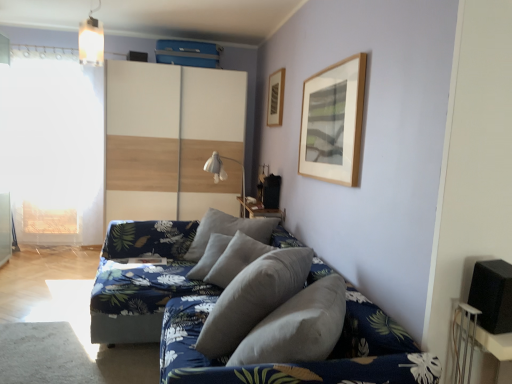
Question: From a real-world perspective, is white fabric lampshade at center physically above white wood dresser at center?

Choices:
 (A) yes
 (B) no

Answer: (B)

Question: From the image's perspective, does white fabric lampshade at center appear higher than white wood dresser at center?

Choices:
 (A) yes
 (B) no

Answer: (B)

Question: Does white fabric lampshade at center appear on the left side of white wood dresser at center?

Choices:
 (A) yes
 (B) no

Answer: (B)

Question: Are white fabric lampshade at center and white wood dresser at center beside each other?

Choices:
 (A) yes
 (B) no

Answer: (B)

Question: Does white fabric lampshade at center turn towards white wood dresser at center?

Choices:
 (A) yes
 (B) no

Answer: (B)

Question: Is black matte speaker at right to the left or to the right of metallic pendant light at upper center in the image?

Choices:
 (A) right
 (B) left

Answer: (A)

Question: From a real-world perspective, is black matte speaker at right physically located above or below metallic pendant light at upper center?

Choices:
 (A) above
 (B) below

Answer: (B)

Question: In terms of height, does black matte speaker at right look taller or shorter compared to metallic pendant light at upper center?

Choices:
 (A) short
 (B) tall

Answer: (A)

Question: Do you think black matte speaker at right is within metallic pendant light at upper center, or outside of it?

Choices:
 (A) inside
 (B) outside

Answer: (B)

Question: Considering their positions, is wooden table at center, which is the 1th table from left to right, located in front of or behind white wood dresser at center?

Choices:
 (A) behind
 (B) front

Answer: (B)

Question: From a real-world perspective, is wooden table at center, the second table from the bottom, positioned above or below white wood dresser at center?

Choices:
 (A) below
 (B) above

Answer: (A)

Question: Looking at the image, does wooden table at center, the second table from the bottom, seem bigger or smaller compared to white wood dresser at center?

Choices:
 (A) small
 (B) big

Answer: (A)

Question: Is point [x=241, y=200] closer or farther from the camera than point [x=192, y=115]?

Choices:
 (A) farther
 (B) closer

Answer: (A)

Question: Considering the positions of white plastic table at lower right, which is the 2th table in left-to-right order, and white matte window screen at left in the image, is white plastic table at lower right, which is the 2th table in left-to-right order, taller or shorter than white matte window screen at left?

Choices:
 (A) short
 (B) tall

Answer: (A)

Question: Considering the positions of point (464, 347) and point (98, 183), is point (464, 347) closer or farther from the camera than point (98, 183)?

Choices:
 (A) closer
 (B) farther

Answer: (A)